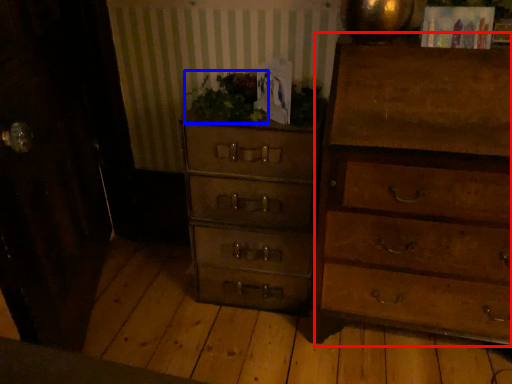
Question: Which object appears farthest to the camera in this image, chest of drawers (highlighted by a red box) or houseplant (highlighted by a blue box)?

Choices:
 (A) chest of drawers
 (B) houseplant

Answer: (B)